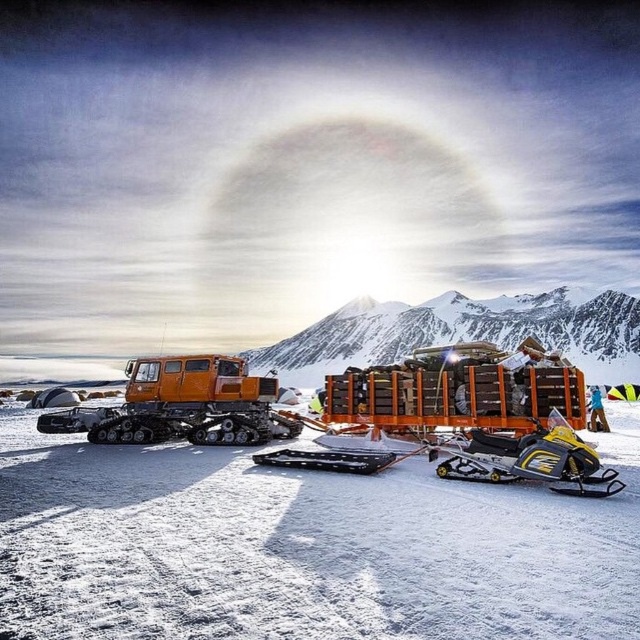
Who is positioned more to the right, snowy rocky mountain at upper center or orange metallic tracked vehicle at left?

snowy rocky mountain at upper center is more to the right.

Which of these two, snowy rocky mountain at upper center or orange metallic tracked vehicle at left, stands shorter?

orange metallic tracked vehicle at left

Find the location of a particular element. snowy rocky mountain at upper center is located at coordinates (465, 332).

Can you confirm if white powdery snow at center is smaller than yellow matte snowmobile at lower right?

No.

How distant is white powdery snow at center from yellow matte snowmobile at lower right?

white powdery snow at center is 32.25 feet from yellow matte snowmobile at lower right.

This screenshot has width=640, height=640. What are the coordinates of `white powdery snow at center` in the screenshot? It's located at (301, 547).

From the picture: Can you confirm if white powdery snow at center is bigger than snowy rocky mountain at upper center?

No.

Measure the distance between point [387,486] and camera.

Point [387,486] and camera are 52.88 meters apart.

This screenshot has height=640, width=640. Find the location of `white powdery snow at center`. white powdery snow at center is located at coordinates (301, 547).

In order to click on white powdery snow at center in this screenshot , I will do `click(301, 547)`.